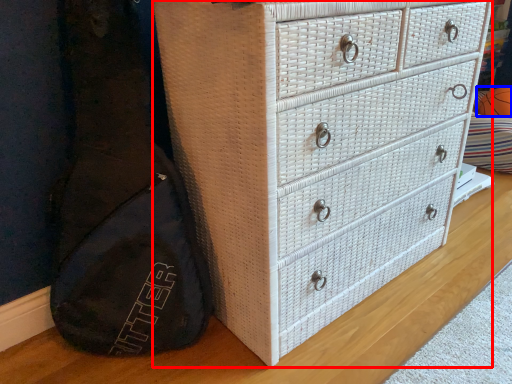
Question: Which of the following is the closest to the observer, chest of drawers (highlighted by a red box) or basketball (highlighted by a blue box)?

Choices:
 (A) chest of drawers
 (B) basketball

Answer: (A)